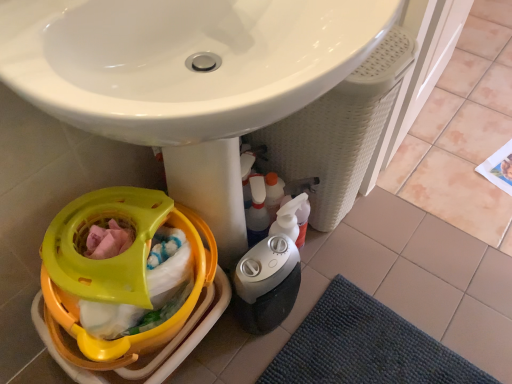
Find the location of a particular element. This screenshot has height=384, width=512. vacant space to the right of gray plastic humidifier at lower center is located at coordinates (319, 286).